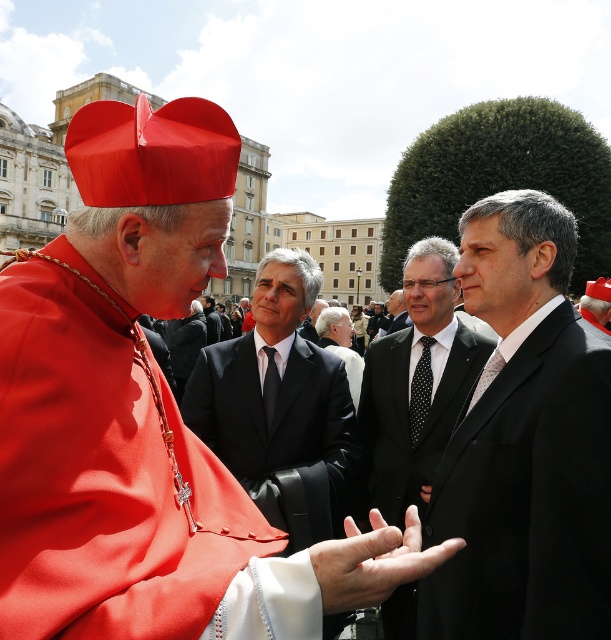
Question: Can you confirm if matte red hat at upper left is positioned to the right of black dotted tie at center?

Choices:
 (A) no
 (B) yes

Answer: (A)

Question: Which object is the farthest from the dark suit at center?

Choices:
 (A) black dotted tie at center
 (B) black satin suit at center
 (C) dark gray suit at center

Answer: (B)

Question: Which object is positioned farthest from the dark gray suit at center?

Choices:
 (A) white matte hand at center
 (B) black suit at center
 (C) black dotted tie at center

Answer: (A)

Question: Does black dotted tie at center appear on the left side of dark gray suit at center?

Choices:
 (A) no
 (B) yes

Answer: (A)

Question: Among these points, which one is nearest to the camera?

Choices:
 (A) (334, 314)
 (B) (235, 346)
 (C) (404, 540)

Answer: (C)

Question: Does black suit at center lie in front of dark gray suit at center?

Choices:
 (A) no
 (B) yes

Answer: (B)